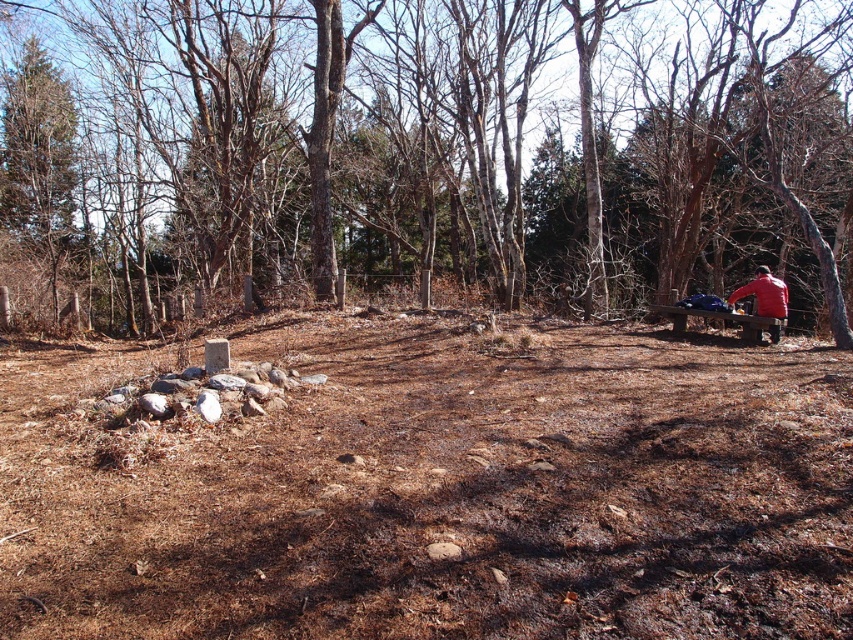
Does brown bark tree at center appear under red matte jacket at right?

No, brown bark tree at center is not below red matte jacket at right.

Which of these two, brown bark tree at center or red matte jacket at right, stands taller?

With more height is brown bark tree at center.

You are a GUI agent. You are given a task and a screenshot of the screen. Output one action in this format:
    pyautogui.click(x=<x>, y=<y>)
    Task: Click on the brown bark tree at center
    
    Given the screenshot: What is the action you would take?
    pyautogui.click(x=428, y=148)

Between brown wooden bench at right and red matte jacket at right, which one has less height?

brown wooden bench at right is shorter.

Is point (761, 316) positioned before point (776, 284)?

Yes, point (761, 316) is in front of point (776, 284).

Who is more forward, (743, 337) or (758, 304)?

Point (743, 337)

The width and height of the screenshot is (853, 640). Find the location of `brown wooden bench at right`. brown wooden bench at right is located at coordinates (723, 321).

Consider the image. Who is positioned more to the left, brown bark tree at center or brown wooden bench at right?

From the viewer's perspective, brown bark tree at center appears more on the left side.

Between brown bark tree at center and brown wooden bench at right, which one has less height?

With less height is brown wooden bench at right.

Does point (726, 84) lie in front of point (720, 323)?

No, (726, 84) is further to viewer.

You are a GUI agent. You are given a task and a screenshot of the screen. Output one action in this format:
    pyautogui.click(x=<x>, y=<y>)
    Task: Click on the brown bark tree at center
    This screenshot has width=853, height=640.
    Given the screenshot: What is the action you would take?
    pyautogui.click(x=428, y=148)